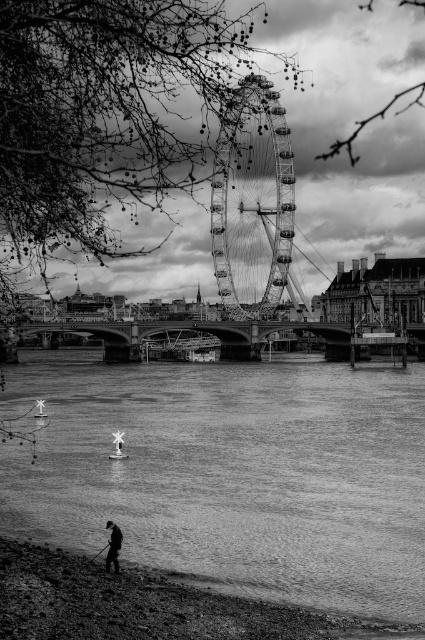
Question: Based on their relative distances, which object is nearer to the smooth water at lower center?

Choices:
 (A) metallic ferris wheel at center
 (B) smooth pebbles at lower left

Answer: (B)

Question: Is smooth water at lower center wider than metallic ferris wheel at center?

Choices:
 (A) no
 (B) yes

Answer: (B)

Question: Is smooth water at lower center positioned in front of dark gray fabric person at lower center?

Choices:
 (A) yes
 (B) no

Answer: (A)

Question: Among these objects, which one is nearest to the camera?

Choices:
 (A) smooth pebbles at lower left
 (B) smooth water at lower center

Answer: (A)

Question: Which of these objects is positioned closest to the smooth water at lower center?

Choices:
 (A) dark gray fabric person at lower center
 (B) metallic ferris wheel at center

Answer: (A)

Question: Can you confirm if smooth pebbles at lower left is smaller than dark gray fabric person at lower center?

Choices:
 (A) no
 (B) yes

Answer: (A)